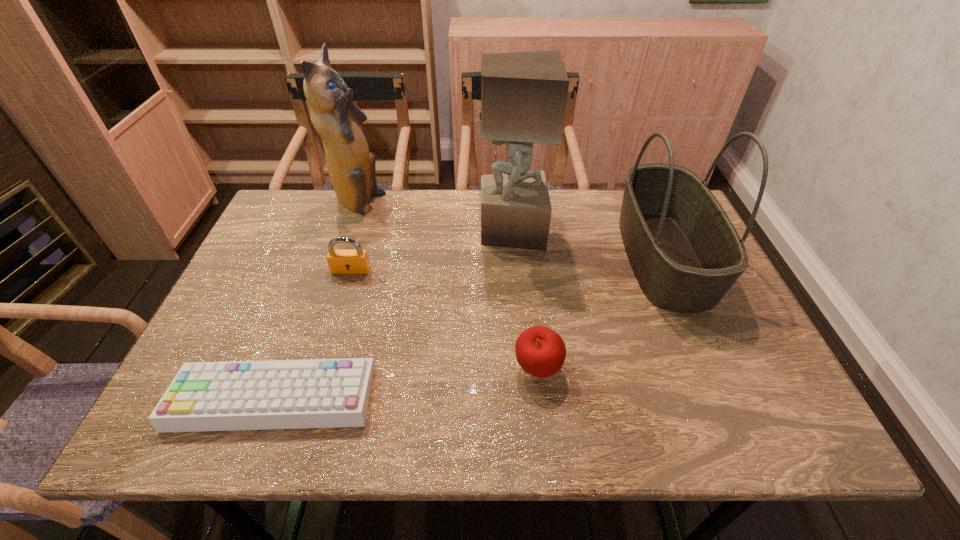
Image resolution: width=960 pixels, height=540 pixels. What are the coordinates of `free space between the cat and the apple` in the screenshot? It's located at (448, 286).

This screenshot has height=540, width=960. Identify the location of vacant area between the padlock and the apple. (444, 319).

The height and width of the screenshot is (540, 960). Find the location of `vacant space that's between the shortest object and the cat`. vacant space that's between the shortest object and the cat is located at coordinates (316, 300).

At what (x,y) coordinates should I click in order to perform the action: click on free space between the sculpture and the cat. Please return your answer as a coordinate pair (x, y). The height and width of the screenshot is (540, 960). Looking at the image, I should click on (435, 217).

What are the coordinates of `unoccupied position between the sculpture and the apple` in the screenshot? It's located at (524, 300).

I want to click on free spot between the basket and the sculpture, so click(x=587, y=244).

Identify the location of object that is the fourth closest to the apple. This screenshot has height=540, width=960. (340, 261).

The width and height of the screenshot is (960, 540). What are the coordinates of `object that ranks as the fifth closest to the sculpture` in the screenshot? It's located at (315, 393).

Identify the location of vacant space that satisfies the following two spatial constraints: 1. on the face of the cat; 2. on the left side of the basket. The height and width of the screenshot is (540, 960). (341, 256).

At what (x,y) coordinates should I click in order to perform the action: click on blank area in the image that satisfies the following two spatial constraints: 1. to unlock the padlock from the front; 2. on the left side of the apple. Please return your answer as a coordinate pair (x, y). Image resolution: width=960 pixels, height=540 pixels. Looking at the image, I should click on (322, 369).